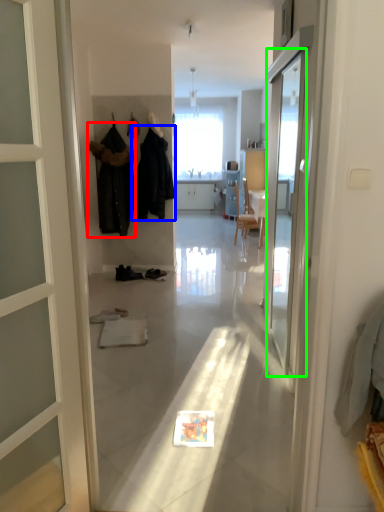
Question: Considering the real-world distances, which object is closest to clothing (highlighted by a red box)? clothing (highlighted by a blue box) or screen door (highlighted by a green box).

Choices:
 (A) clothing
 (B) screen door

Answer: (A)